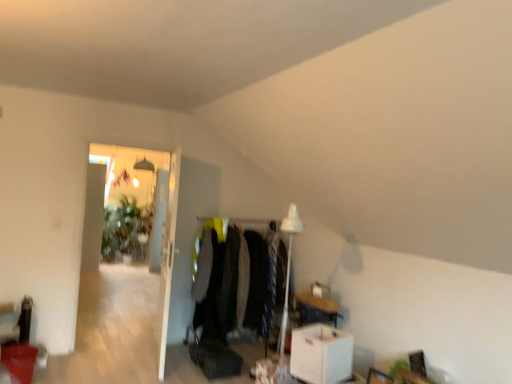
At what (x,y) coordinates should I click in order to perform the action: click on vacant space in between white glossy door at upper left and transparent glass door at left. Please return your answer as a coordinate pair (x, y). Looking at the image, I should click on (123, 357).